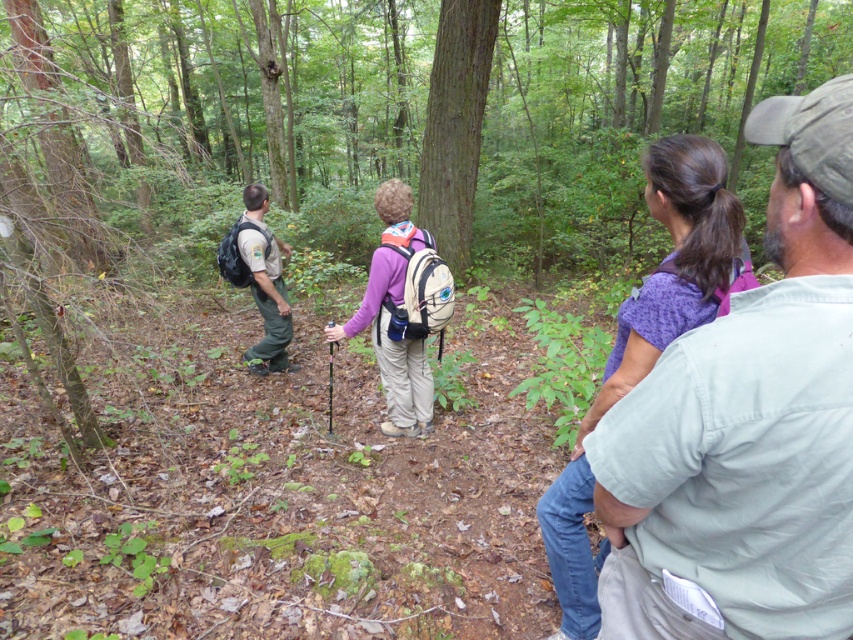
Question: Is purple matte backpack at center smaller than green uniform at left?

Choices:
 (A) yes
 (B) no

Answer: (A)

Question: Is gray cotton shirt at upper right positioned before green uniform at left?

Choices:
 (A) no
 (B) yes

Answer: (B)

Question: Is gray cotton shirt at upper right positioned in front of purple matte backpack at center?

Choices:
 (A) yes
 (B) no

Answer: (A)

Question: Based on their relative distances, which object is nearer to the purple matte backpack at center?

Choices:
 (A) gray cotton shirt at upper right
 (B) green uniform at left

Answer: (B)

Question: Among these points, which one is farthest from the camera?

Choices:
 (A) (251, 368)
 (B) (614, 595)

Answer: (A)

Question: Based on their relative distances, which object is nearer to the purple matte backpack at center?

Choices:
 (A) green uniform at left
 (B) gray cotton shirt at upper right

Answer: (A)